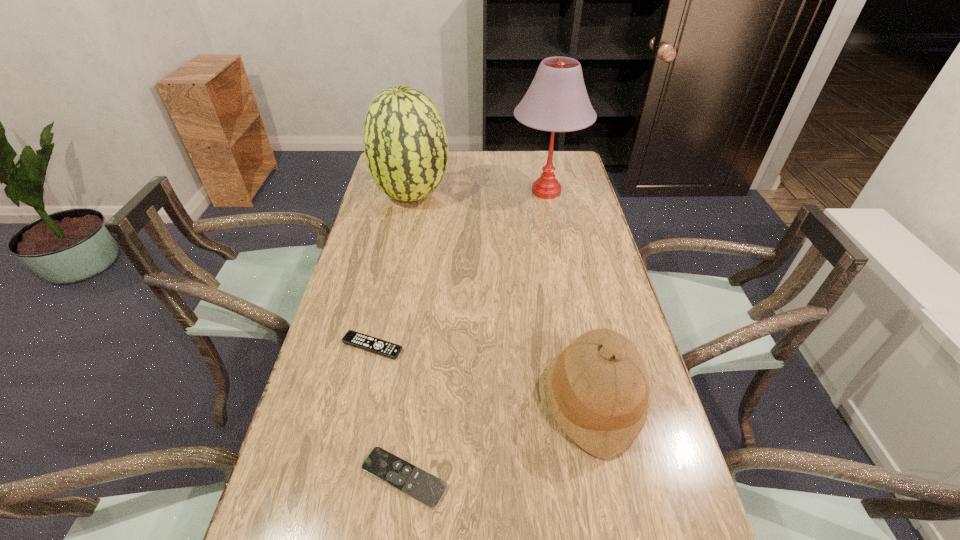
Find the location of `object at the far right corner`. object at the far right corner is located at coordinates (557, 101).

What are the coordinates of `free space at the left edge of the desktop` in the screenshot? It's located at (345, 469).

In the image, there is a desktop. At what (x,y) coordinates should I click in order to perform the action: click on vacant region at the right edge. Please return your answer as a coordinate pair (x, y). This screenshot has height=540, width=960. Looking at the image, I should click on (573, 277).

The image size is (960, 540). What are the coordinates of `free space that is in between the shorter remote control and the taller remote control` in the screenshot? It's located at (388, 412).

Identify the location of vacant space that is in between the third tallest object and the second tallest object. This screenshot has width=960, height=540. (502, 298).

You are a GUI agent. You are given a task and a screenshot of the screen. Output one action in this format:
    pyautogui.click(x=<x>, y=<y>)
    Task: Click on the empty space between the farther remote control and the shorter remote control
    This screenshot has height=540, width=960.
    Given the screenshot: What is the action you would take?
    pyautogui.click(x=388, y=412)

You are a GUI agent. You are given a task and a screenshot of the screen. Output one action in this format:
    pyautogui.click(x=<x>, y=<y>)
    Task: Click on the free space between the shorter remote control and the taller remote control
    
    Given the screenshot: What is the action you would take?
    pyautogui.click(x=388, y=412)

Identify the location of free space that is in between the tallest object and the hat. (569, 296).

Where is `object that stands as the fourth closest to the fourth tallest object`? The width and height of the screenshot is (960, 540). object that stands as the fourth closest to the fourth tallest object is located at coordinates [557, 101].

Identify the location of object that is the second nearest to the hat. (353, 338).